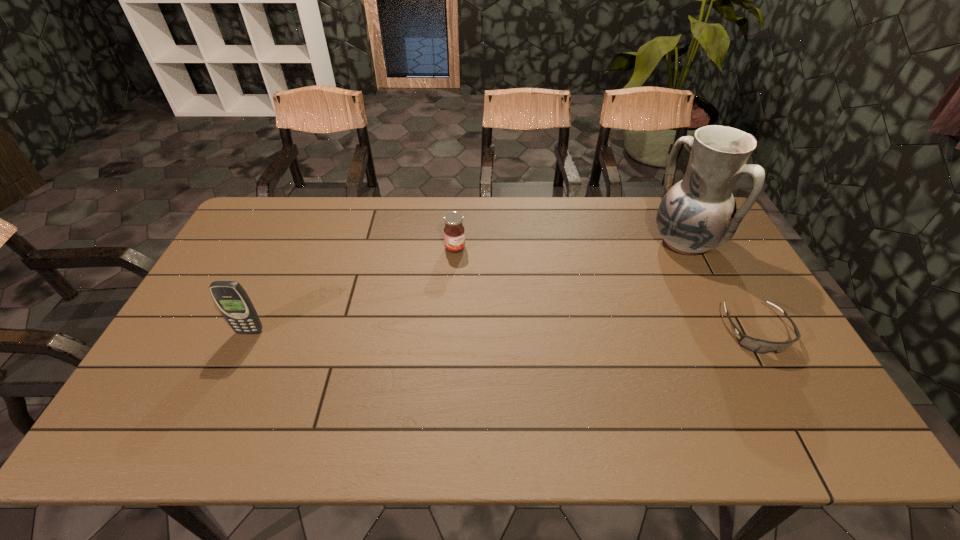
At what (x,y) coordinates should I click in order to perform the action: click on vacant region located on the label side of the jam. Please return your answer as a coordinate pair (x, y). Looking at the image, I should click on (484, 283).

The height and width of the screenshot is (540, 960). Find the location of `vacant point located 0.390m on the front-facing side of the tallest object`. vacant point located 0.390m on the front-facing side of the tallest object is located at coordinates point(580,315).

Identify the location of vacant space located 0.140m on the front-facing side of the tallest object. (636, 276).

Identify the location of vacant region located 0.390m on the front-facing side of the tallest object. (580, 315).

Identify the location of object that is positioned at the far edge. The height and width of the screenshot is (540, 960). (698, 214).

The height and width of the screenshot is (540, 960). In order to click on object that is positioned at the left edge in this screenshot , I will do `click(230, 297)`.

You are a GUI agent. You are given a task and a screenshot of the screen. Output one action in this format:
    pyautogui.click(x=<x>, y=<y>)
    Task: Click on the goggles at the right edge
    The image size is (960, 540).
    Given the screenshot: What is the action you would take?
    pyautogui.click(x=760, y=346)

Where is `pitcher that is at the right edge`? pitcher that is at the right edge is located at coordinates (698, 214).

You are a GUI agent. You are given a task and a screenshot of the screen. Output one action in this format:
    pyautogui.click(x=<x>, y=<y>)
    Task: Click on the object that is at the far right corner
    
    Given the screenshot: What is the action you would take?
    pyautogui.click(x=698, y=214)

Image resolution: width=960 pixels, height=540 pixels. In the image, there is a desktop. What are the coordinates of `vacant space at the far edge` in the screenshot? It's located at (325, 219).